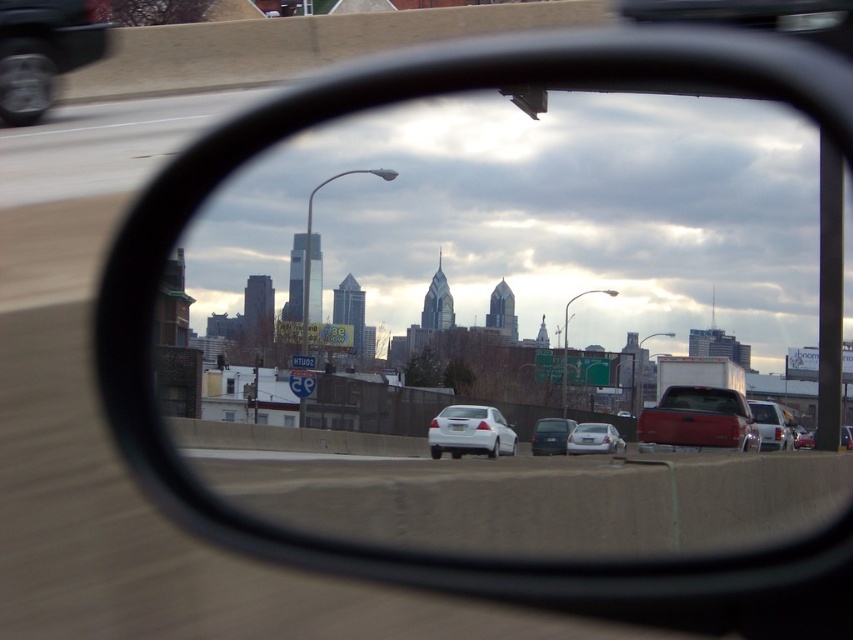
Question: Can you confirm if clear glass mirror at center is bigger than shiny red truck at center?

Choices:
 (A) no
 (B) yes

Answer: (B)

Question: Which point appears closest to the camera in this image?

Choices:
 (A) (790, 440)
 (B) (283, 516)

Answer: (B)

Question: Does white glossy sedan at center appear over matte black sedan at center?

Choices:
 (A) yes
 (B) no

Answer: (A)

Question: Which point is closer to the camera?

Choices:
 (A) white glossy sedan at center
 (B) matte red truck at center

Answer: (A)

Question: Which point is farther to the camera?

Choices:
 (A) (486, 451)
 (B) (22, 36)

Answer: (A)

Question: Does metallic gray car at upper left appear over satin silver sedan at center?

Choices:
 (A) no
 (B) yes

Answer: (B)